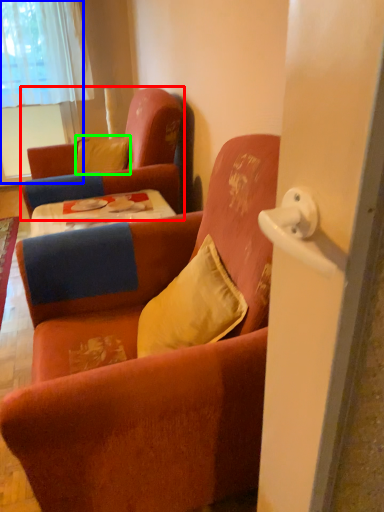
Question: Estimate the real-world distances between objects in this image. Which object is closer to chair (highlighted by a red box), window (highlighted by a blue box) or pillow (highlighted by a green box)?

Choices:
 (A) window
 (B) pillow

Answer: (B)